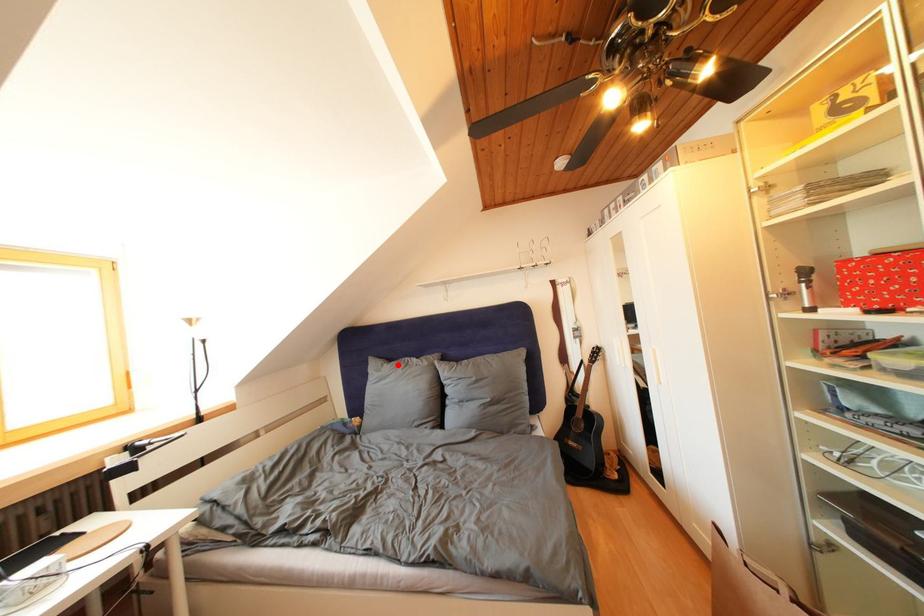
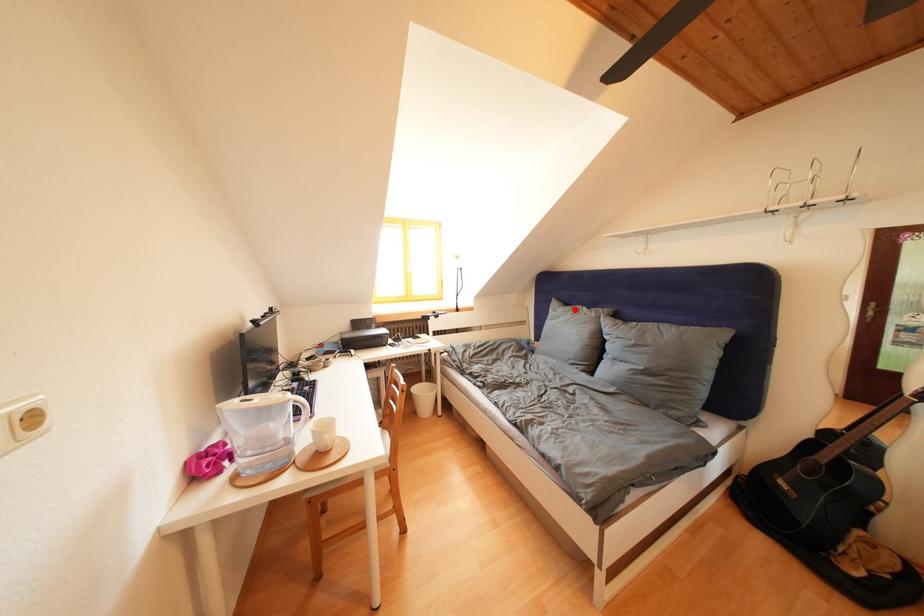
I am providing you with two images of the same scene from different viewpoints. A red point is marked on the first image and another point is marked on the second image. Is the red point in image1 aligned with the point shown in image2?

Yes